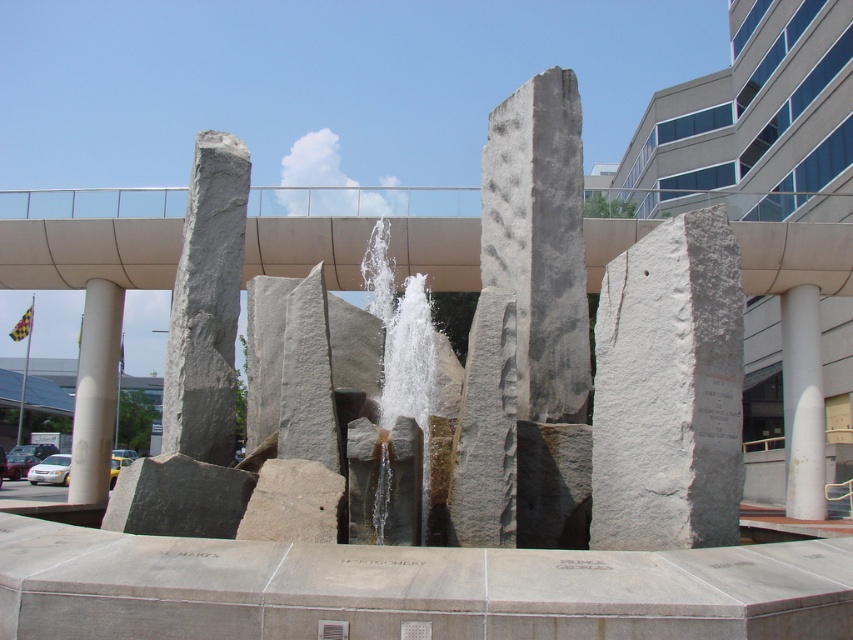
Can you confirm if white stone waterfall at center is bigger than white smooth column at right?

No.

In order to click on white stone waterfall at center in this screenshot , I will do `click(409, 349)`.

Can you confirm if white smooth column at right is positioned below white smooth column at left?

Indeed, white smooth column at right is positioned under white smooth column at left.

Describe the element at coordinates (802, 403) in the screenshot. Image resolution: width=853 pixels, height=640 pixels. I see `white smooth column at right` at that location.

Which is in front, point (816, 476) or point (80, 406)?

Positioned in front is point (816, 476).

Find the location of a particular element. white smooth column at right is located at coordinates (802, 403).

Who is higher up, white stone pillar at center or white smooth column at left?

white stone pillar at center is higher up.

Is point (614, 300) positioned behind point (82, 428)?

No, it is not.

Locate an element on the screen. white stone pillar at center is located at coordinates (669, 388).